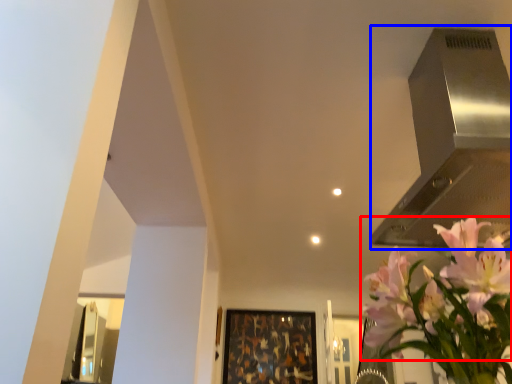
Question: Among these objects, which one is nearest to the camera, flower (highlighted by a red box) or vent (highlighted by a blue box)?

Choices:
 (A) flower
 (B) vent

Answer: (A)